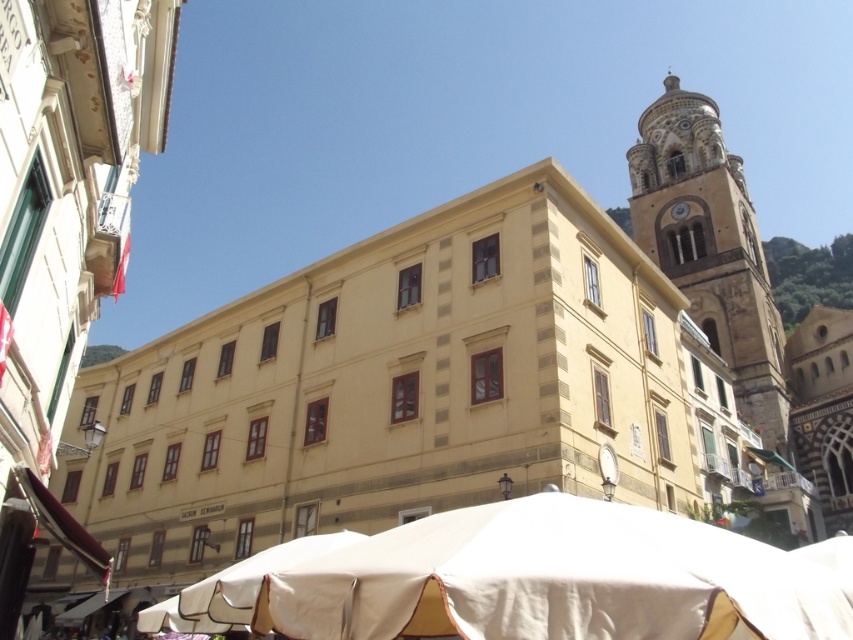
Question: Does white fabric canopy at lower center lie in front of golden stone bell tower at upper right?

Choices:
 (A) no
 (B) yes

Answer: (B)

Question: Which of the following is the farthest from the observer?

Choices:
 (A) white fabric canopy at lower center
 (B) golden stone bell tower at upper right

Answer: (B)

Question: Does white fabric canopy at lower center have a lesser width compared to golden stone bell tower at upper right?

Choices:
 (A) yes
 (B) no

Answer: (A)

Question: Does white fabric canopy at lower center appear on the right side of golden stone bell tower at upper right?

Choices:
 (A) no
 (B) yes

Answer: (A)

Question: Which point is farther from the camera taking this photo?

Choices:
 (A) (668, 266)
 (B) (502, 572)

Answer: (A)